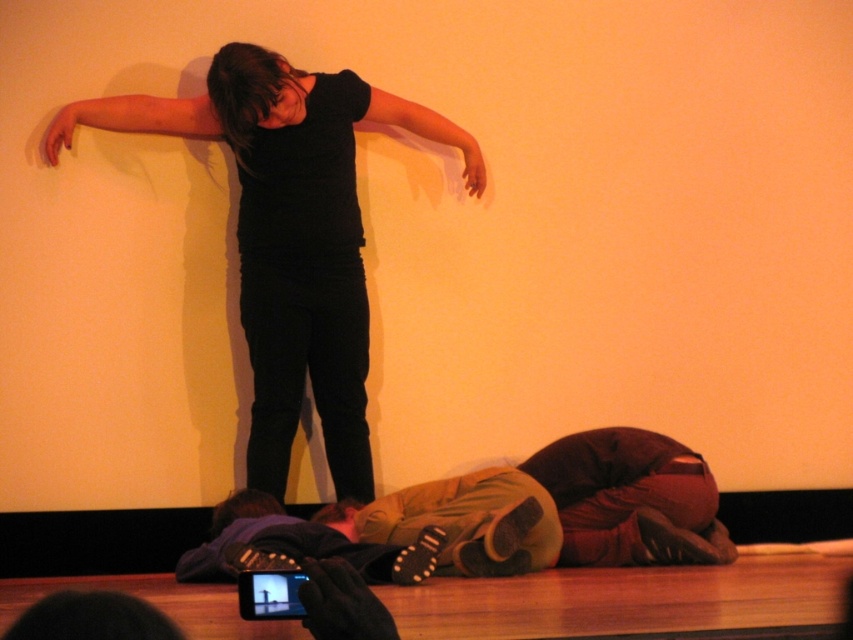
Question: Does brown fabric sleeping bag at lower center appear on the right side of matte black hand at upper left?

Choices:
 (A) no
 (B) yes

Answer: (B)

Question: Can you confirm if black matte shirt at upper center is positioned to the left of brown fabric sleeping bag at lower center?

Choices:
 (A) no
 (B) yes

Answer: (B)

Question: Which of these objects is positioned closest to the brown fabric sleeping bag at lower center?

Choices:
 (A) matte black hand at upper center
 (B) matte black arm at upper left
 (C) black matte arm at upper center

Answer: (A)

Question: Is the position of brown fabric sleeping bag at lower center less distant than that of black matte arm at upper center?

Choices:
 (A) no
 (B) yes

Answer: (B)

Question: Which point is farther to the camera?

Choices:
 (A) black matte shirt at upper center
 (B) matte black hand at upper left
 (C) brown fabric sleeping bag at lower center

Answer: (B)

Question: Which of the following is the closest to the observer?

Choices:
 (A) black matte shirt at upper center
 (B) black matte arm at upper center
 (C) matte black hand at upper left

Answer: (A)